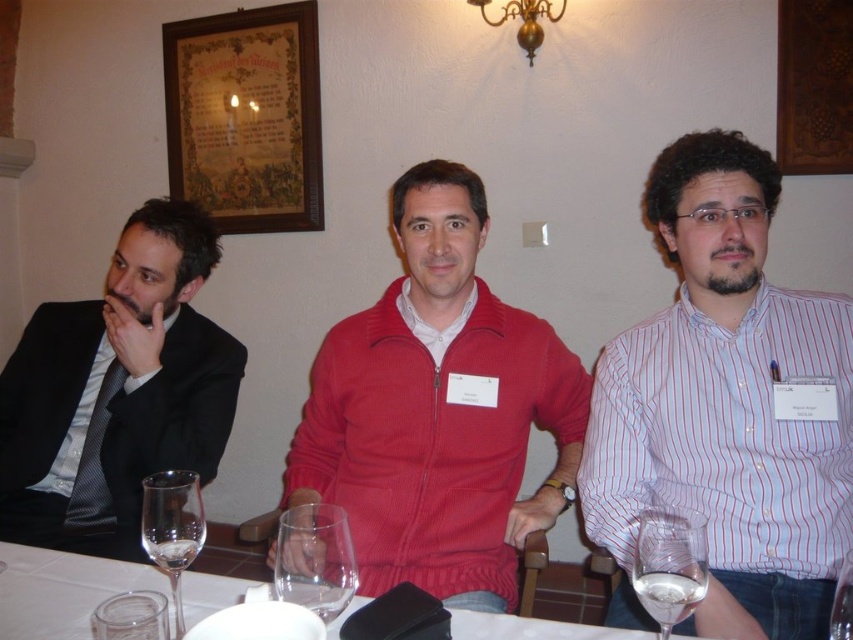
You are standing in front of the dining table where three people are seated. You notice two points marked in the image. Which point, point (x=235, y=172) or point (x=842, y=627), is closer to you?

Point (x=235, y=172) is closer to you because it is further to the viewer than point (x=842, y=627).

You are a waiter at a formal event and need to place a dessert plate on the table. The dessert plate has a diameter of 25 cm. Can you confirm if the white glossy table at center has enough space to accommodate the dessert plate without it overlapping the transparent glass wine glass at center?

The white glossy table at center is larger in size than the transparent glass wine glass at center, so there should be sufficient space to place the dessert plate without overlapping the wine glass.

You are a server at a formal dinner and need to place a decorative plate that is 12 inches wide on the table. Can the white glossy table at center accommodate the plate without it hanging over the edge? Please consider the transparent glass wine glass at center when deciding.

The white glossy table at center is wider than the transparent glass wine glass at center. Since the plate is 12 inches wide, and the table is wider than the wine glass, it should fit without overhanging, provided the glass isn